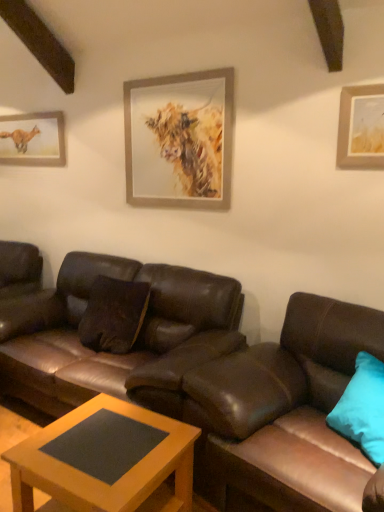
Question: Looking at their shapes, would you say brown leather couch at lower right, the second studio couch in the left-to-right sequence, is wider or thinner than brown leather couch at center, which is the first studio couch from left to right?

Choices:
 (A) wide
 (B) thin

Answer: (A)

Question: Based on their positions, is brown leather couch at lower right, arranged as the first studio couch when viewed from the right, located to the left or right of brown leather couch at center, which ranks as the second studio couch in right-to-left order?

Choices:
 (A) left
 (B) right

Answer: (B)

Question: Estimate the real-world distances between objects in this image. Which object is closer to the teal fabric pillow at right?

Choices:
 (A) matte paper picture frame at upper left, marked as the first picture frame in a back-to-front arrangement
 (B) wooden matte coffee table at center
 (C) wooden-framed painting of a cow at upper center, which is the 2th picture frame from back to front
 (D) brown leather couch at lower right, the second studio couch in the left-to-right sequence
 (E) brown leather couch at center, which ranks as the second studio couch in right-to-left order

Answer: (D)

Question: Which object is the farthest from the wooden-framed painting of a cow at upper center, marked as the first picture frame in a front-to-back arrangement?

Choices:
 (A) brown leather couch at center, which is the first studio couch from left to right
 (B) brown leather couch at lower right, the second studio couch in the left-to-right sequence
 (C) matte paper picture frame at upper left, acting as the second picture frame starting from the front
 (D) teal fabric pillow at right
 (E) wooden matte coffee table at center

Answer: (E)